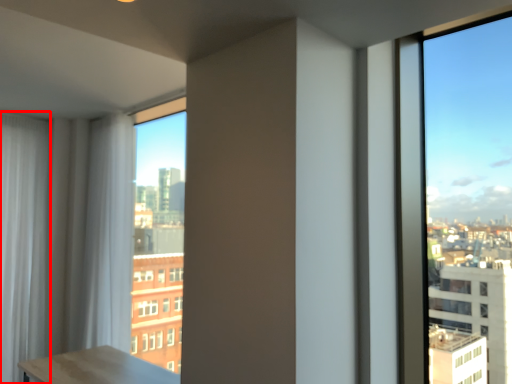
Question: From the image's perspective, considering the relative positions of curtain (annotated by the red box) and curtain in the image provided, where is curtain (annotated by the red box) located with respect to the staircase?

Choices:
 (A) below
 (B) above

Answer: (A)